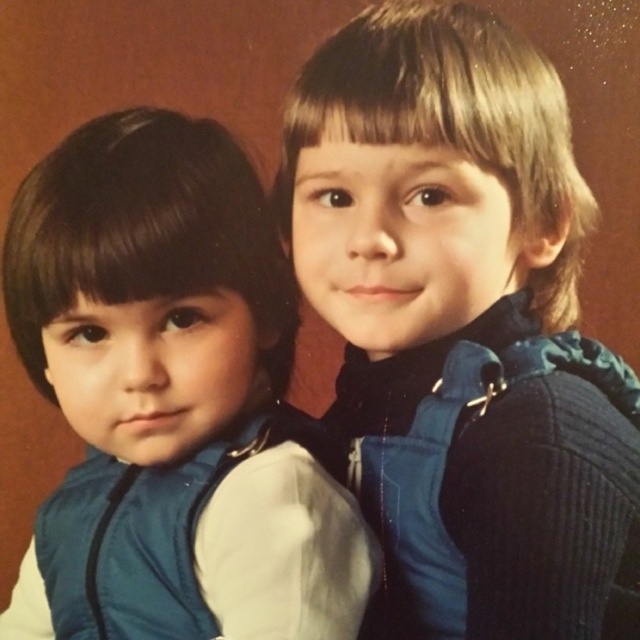
Question: Does matte blue vest at left have a greater width compared to teal fabric vest at left?

Choices:
 (A) no
 (B) yes

Answer: (B)

Question: Which of the following is the closest to the observer?

Choices:
 (A) blue fabric vest at center
 (B) matte blue vest at left
 (C) blue fleece vest at right

Answer: (A)

Question: Is matte blue vest at left to the right of blue fleece vest at right from the viewer's perspective?

Choices:
 (A) no
 (B) yes

Answer: (A)

Question: Which of the following is the closest to the observer?

Choices:
 (A) blue fleece vest at right
 (B) matte blue vest at left
 (C) blue fabric vest at center

Answer: (C)

Question: Estimate the real-world distances between objects in this image. Which object is farther from the teal fabric vest at left?

Choices:
 (A) blue fleece vest at right
 (B) blue fabric vest at center
 (C) matte blue vest at left

Answer: (B)

Question: Can you confirm if blue fabric vest at center is wider than matte blue vest at left?

Choices:
 (A) yes
 (B) no

Answer: (B)